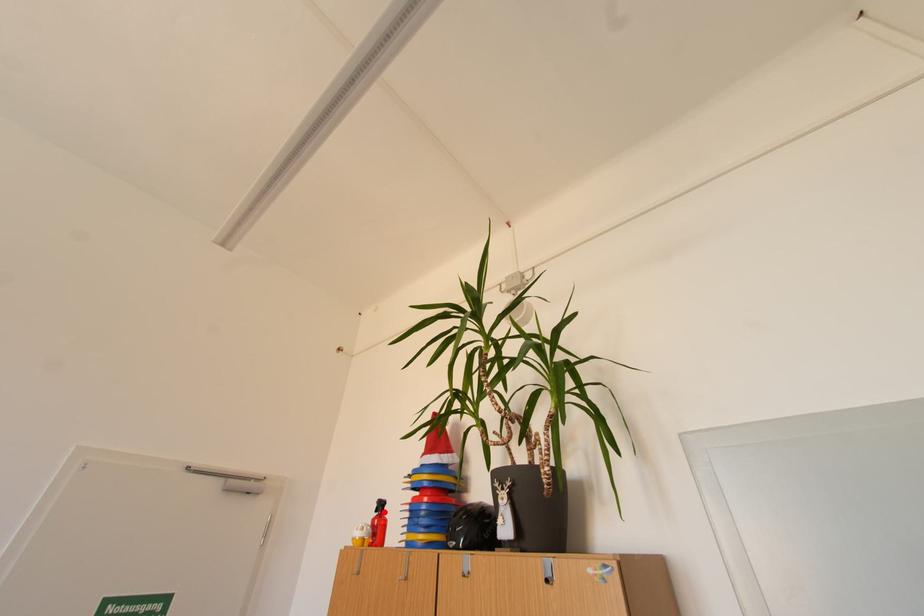
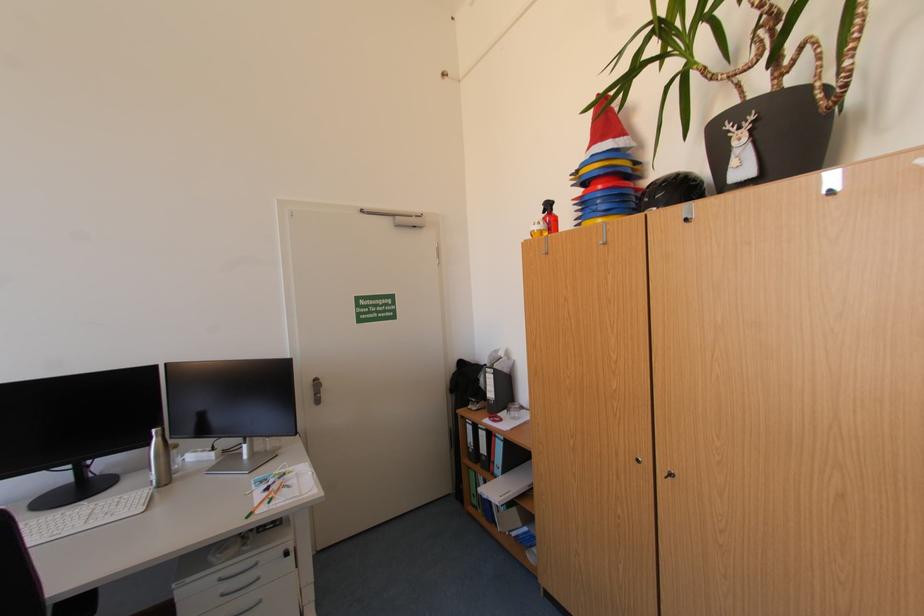
Question: I am providing you with two images of the same scene from different viewpoints. A red point is marked on the first image. Is the red point's position out of view in image 2?

Choices:
 (A) Yes
 (B) No

Answer: (B)